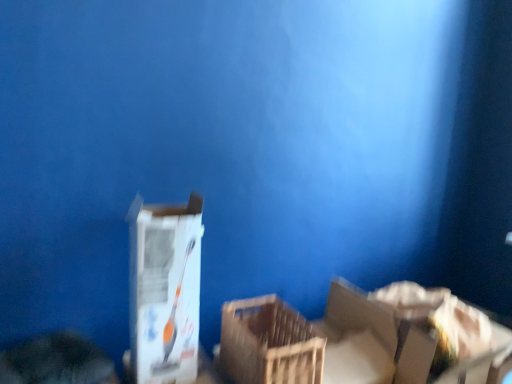
Question: From the image's perspective, would you say white cardboard box at lower right is shown under wooden crate at center?

Choices:
 (A) yes
 (B) no

Answer: (A)

Question: Is white cardboard box at lower right smaller than wooden crate at center?

Choices:
 (A) no
 (B) yes

Answer: (A)

Question: Is white cardboard box at lower right completely or partially outside of wooden crate at center?

Choices:
 (A) yes
 (B) no

Answer: (A)

Question: Is white cardboard box at lower right further to the viewer compared to wooden crate at center?

Choices:
 (A) yes
 (B) no

Answer: (A)

Question: From a real-world perspective, is white cardboard box at lower right located higher than wooden crate at center?

Choices:
 (A) no
 (B) yes

Answer: (A)

Question: From a real-world perspective, relative to white cardboard box at lower right, is white cardboard box at center vertically above or below?

Choices:
 (A) above
 (B) below

Answer: (A)

Question: Would you say white cardboard box at center is to the left or to the right of white cardboard box at lower right in the picture?

Choices:
 (A) right
 (B) left

Answer: (B)

Question: Is point (154, 342) positioned closer to the camera than point (246, 342)?

Choices:
 (A) closer
 (B) farther

Answer: (A)

Question: Choose the correct answer: Is white cardboard box at center inside white cardboard box at lower right or outside it?

Choices:
 (A) outside
 (B) inside

Answer: (A)

Question: Is wooden crate at center to the left or to the right of white cardboard box at lower right in the image?

Choices:
 (A) left
 (B) right

Answer: (A)

Question: Choose the correct answer: Is wooden crate at center inside white cardboard box at lower right or outside it?

Choices:
 (A) outside
 (B) inside

Answer: (A)

Question: Considering the positions of point (321, 362) and point (372, 342), is point (321, 362) closer or farther from the camera than point (372, 342)?

Choices:
 (A) farther
 (B) closer

Answer: (B)

Question: From the image's perspective, is wooden crate at center located above or below white cardboard box at lower right?

Choices:
 (A) above
 (B) below

Answer: (A)

Question: Is wooden crate at center in front of or behind white cardboard box at center in the image?

Choices:
 (A) front
 (B) behind

Answer: (B)

Question: Considering the positions of wooden crate at center and white cardboard box at center in the image, is wooden crate at center wider or thinner than white cardboard box at center?

Choices:
 (A) thin
 (B) wide

Answer: (A)